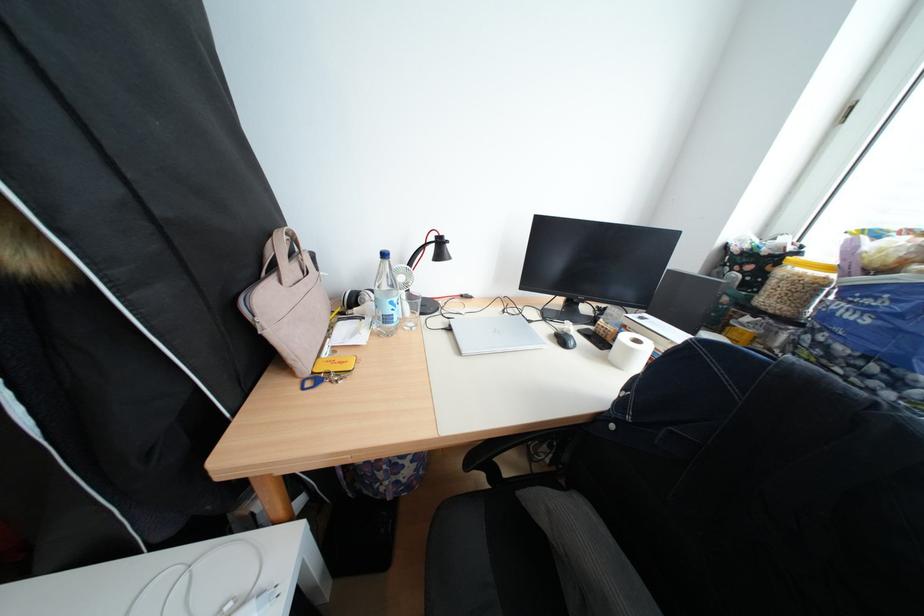
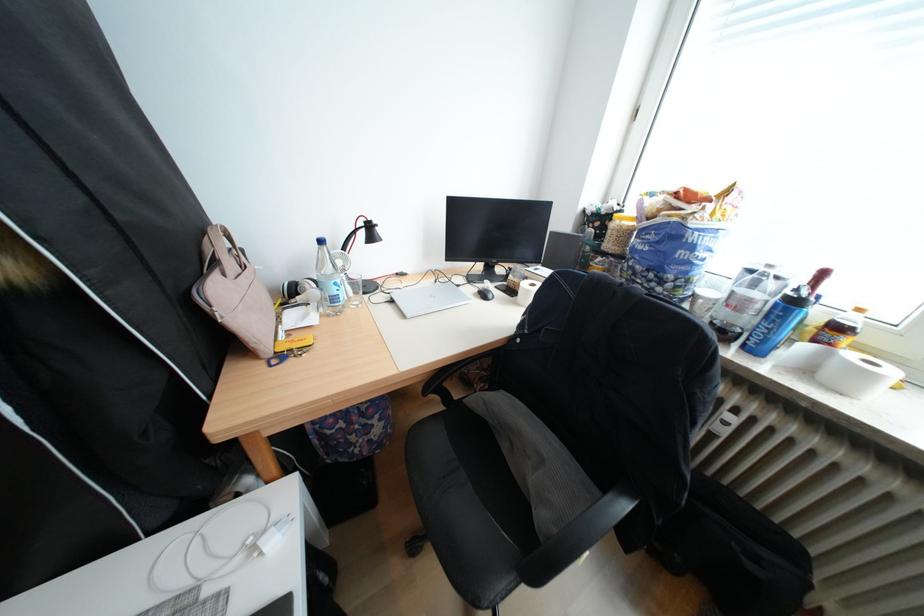
The point at (463, 330) is marked in the first image. Where is the corresponding point in the second image?

(405, 302)